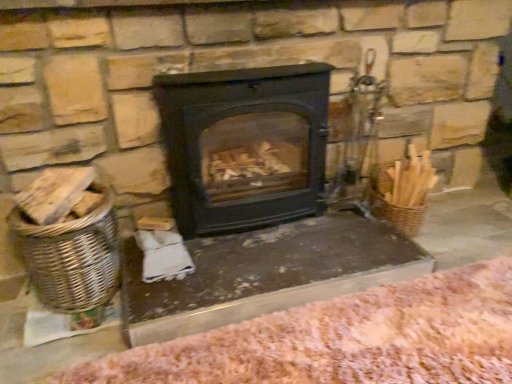
Identify the location of free space below black matte wood burning stove at center (from a real-world perspective). This screenshot has width=512, height=384. (248, 232).